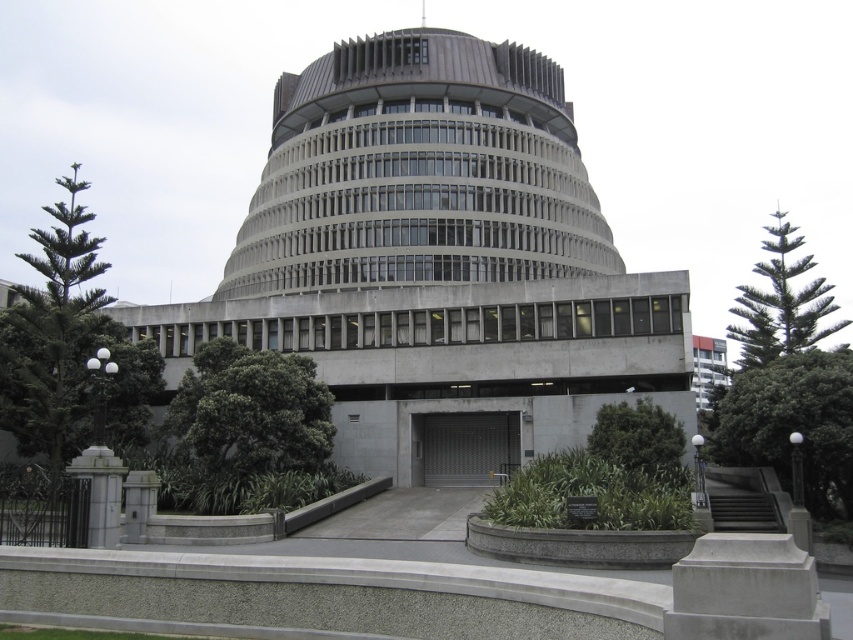
You are standing in front of the modern architectural structure and want to take a photo of the green leafy tree at left. Where should you position yourself to capture the tree in the frame?

To capture the green leafy tree at left in the frame, position yourself so that the tree is centered at the coordinates approximately 0.545 on the horizontal axis and 0.082 on the vertical axis relative to the image.

You are a landscape architect evaluating the building site. You need to determine which of the two plants, the green leafy bush at center or the green textured pine tree at upper right, requires more frequent pruning due to its height. Based on their sizes, which one should you prioritize?

The green textured pine tree at upper right is taller than the green leafy bush at center, so it requires more frequent pruning and should be prioritized.